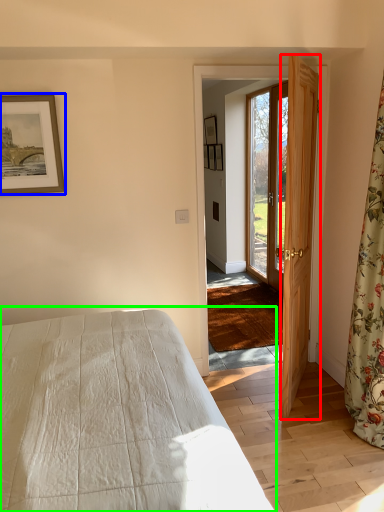
Question: Estimate the real-world distances between objects in this image. Which object is farther from door (highlighted by a red box), picture frame (highlighted by a blue box) or bed (highlighted by a green box)?

Choices:
 (A) picture frame
 (B) bed

Answer: (A)